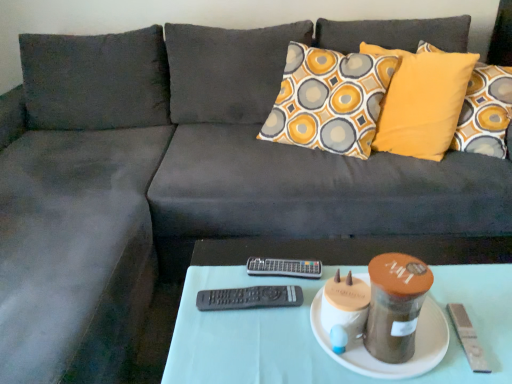
I want to click on empty space that is to the right of black plastic remote at center, the second remote when ordered from back to front, so click(x=306, y=291).